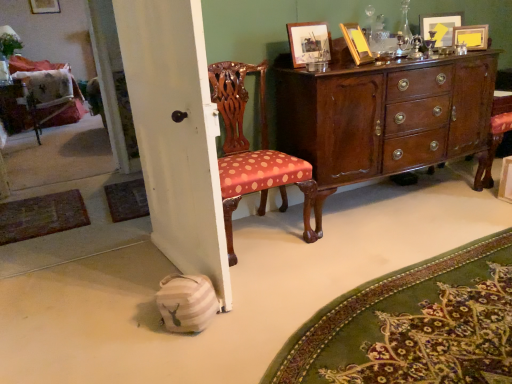
The image size is (512, 384). Find the location of `free region under green felt mat at lower left, the 2th mat in the front-to-back sequence (from a real-world perspective)`. free region under green felt mat at lower left, the 2th mat in the front-to-back sequence (from a real-world perspective) is located at coordinates (52, 209).